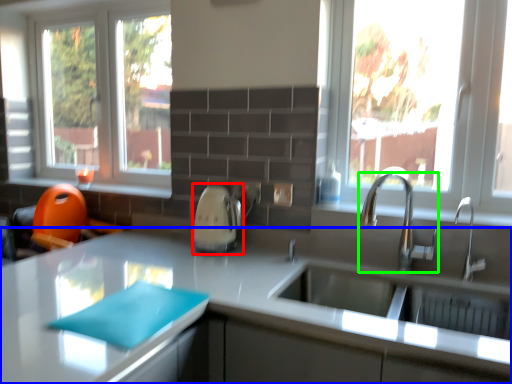
Question: Which object is positioned farthest from appliance (highlighted by a red box)? Select from countertop (highlighted by a blue box) and tap (highlighted by a green box).

Choices:
 (A) countertop
 (B) tap

Answer: (B)